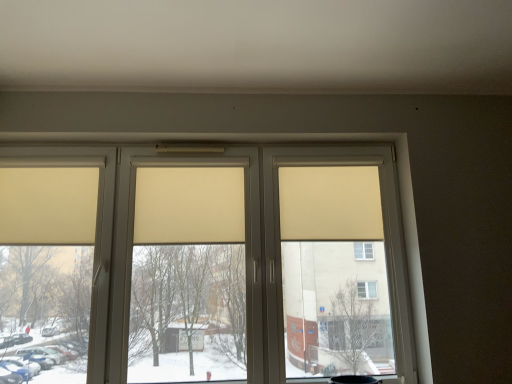
Question: From a real-world perspective, relative to beige fabric curtain at left, which is the 3th curtain in right-to-left order, is beige fabric curtain at center, placed as the third curtain when sorted from left to right, vertically above or below?

Choices:
 (A) below
 (B) above

Answer: (B)

Question: In terms of size, does beige fabric curtain at center, placed as the third curtain when sorted from left to right, appear bigger or smaller than beige fabric curtain at left, which is the 3th curtain in right-to-left order?

Choices:
 (A) small
 (B) big

Answer: (B)

Question: Estimate the real-world distances between objects in this image. Which object is farther from the beige fabric curtain at center, which is counted as the 1th curtain, starting from the right?

Choices:
 (A) beige fabric curtain at left, the first curtain in the left-to-right sequence
 (B) beige matte window at center
 (C) beige fabric curtain at center, the second curtain from the left

Answer: (A)

Question: Considering the real-world distances, which object is closest to the beige fabric curtain at center, the second curtain from the left?

Choices:
 (A) beige matte window at center
 (B) beige fabric curtain at center, which is counted as the 1th curtain, starting from the right
 (C) beige fabric curtain at left, the first curtain in the left-to-right sequence

Answer: (A)